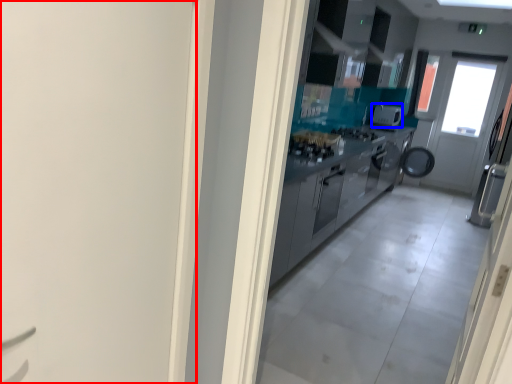
Question: Which point is further to the camera, door (highlighted by a red box) or appliance (highlighted by a blue box)?

Choices:
 (A) door
 (B) appliance

Answer: (B)